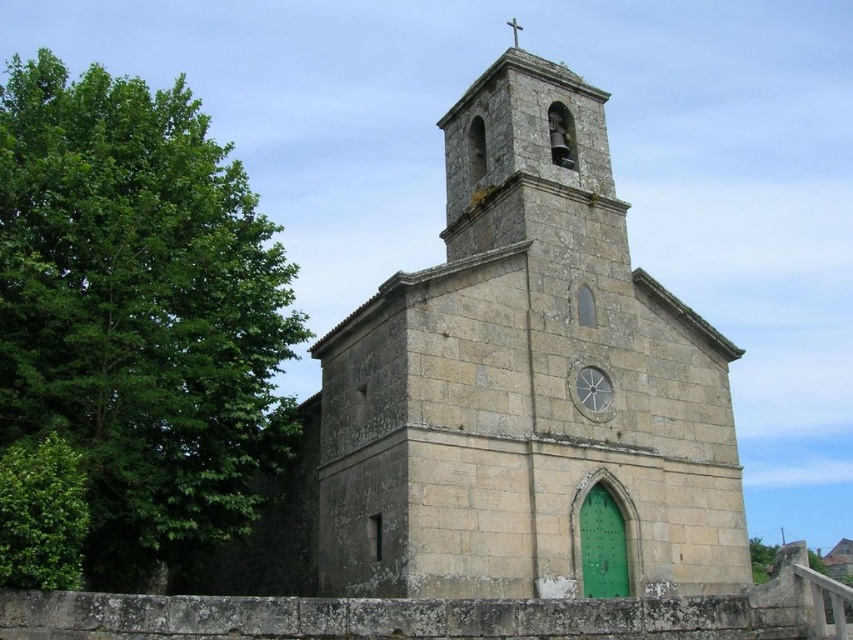
Question: Which point is closer to the camera?

Choices:
 (A) green leafy tree at left
 (B) stone church at center

Answer: (B)

Question: Does stone church at center lie in front of green leafy tree at left?

Choices:
 (A) yes
 (B) no

Answer: (A)

Question: Does stone church at center appear under green leafy tree at left?

Choices:
 (A) yes
 (B) no

Answer: (A)

Question: Which of the following is the closest to the observer?

Choices:
 (A) (253, 248)
 (B) (355, 349)

Answer: (B)

Question: Is stone church at center to the right of green leafy tree at left from the viewer's perspective?

Choices:
 (A) yes
 (B) no

Answer: (A)